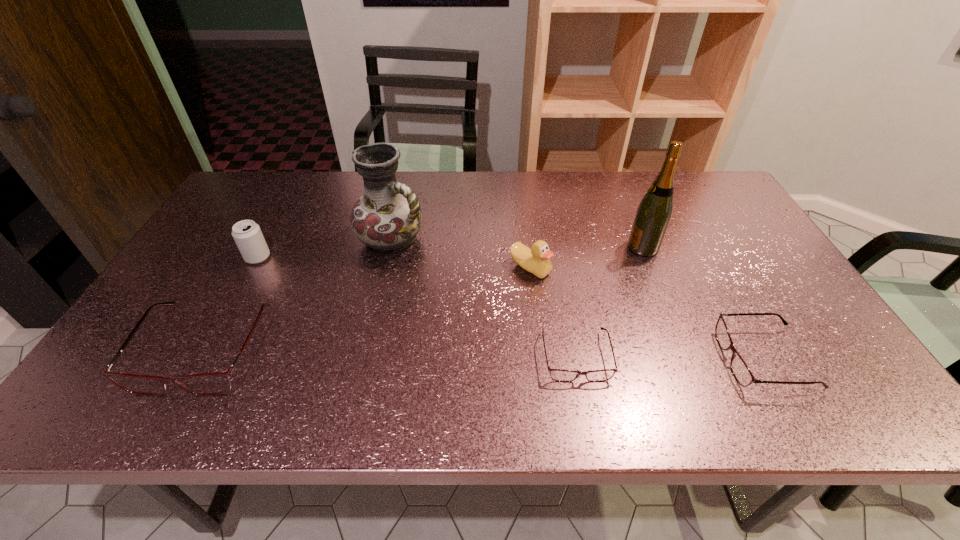
Find the location of a particular element. This screenshot has width=960, height=540. can is located at coordinates (247, 235).

This screenshot has width=960, height=540. In order to click on free space located 0.190m on the lenses of the sixth tallest object in this screenshot , I will do `click(640, 359)`.

Locate an element on the screen. The width and height of the screenshot is (960, 540). free space located on the lenses of the sixth tallest object is located at coordinates (666, 359).

Where is `vacant space situated on the lenses of the sixth tallest object`? The height and width of the screenshot is (540, 960). vacant space situated on the lenses of the sixth tallest object is located at coordinates (649, 359).

You are a GUI agent. You are given a task and a screenshot of the screen. Output one action in this format:
    pyautogui.click(x=<x>, y=<y>)
    Task: Click on the free space located 0.240m at the beak of the duck
    This screenshot has width=960, height=540.
    Given the screenshot: What is the action you would take?
    pyautogui.click(x=541, y=358)

You are a GUI agent. You are given a task and a screenshot of the screen. Output one action in this format:
    pyautogui.click(x=<x>, y=<y>)
    Task: Click on the free spot located on the front-facing side of the wine bottle
    Image resolution: width=960 pixels, height=540 pixels.
    Given the screenshot: What is the action you would take?
    pyautogui.click(x=596, y=247)

The width and height of the screenshot is (960, 540). What are the coordinates of `free space located on the front-facing side of the wine bottle` in the screenshot? It's located at (589, 247).

This screenshot has height=540, width=960. I want to click on vacant region located on the front-facing side of the wine bottle, so click(540, 247).

In order to click on free space located on the left of the fifth object from right to left in this screenshot , I will do `click(333, 239)`.

Locate an element on the screen. This screenshot has height=540, width=960. free space located 0.350m on the right of the can is located at coordinates (396, 258).